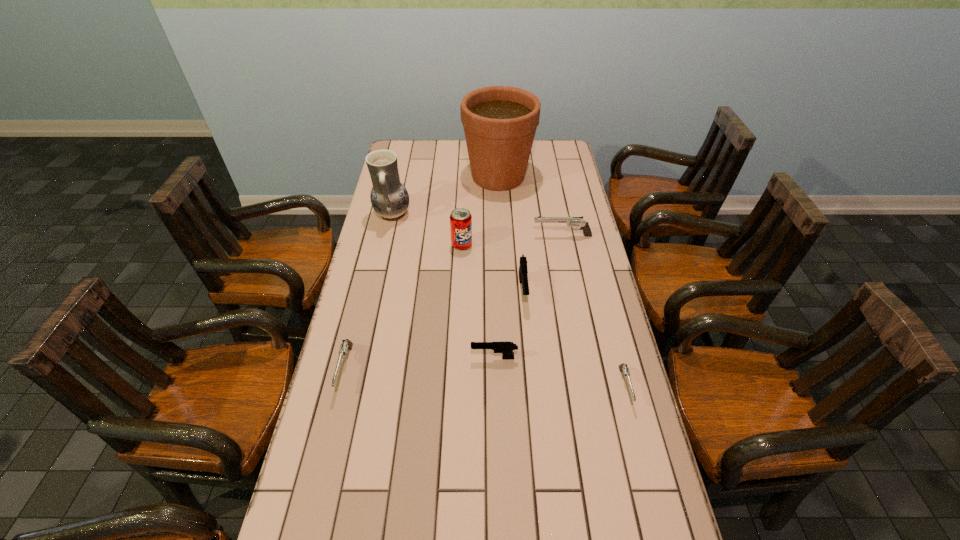
The image size is (960, 540). I want to click on vacant position located 0.150m on the front-facing side of the biggest silver pistol, so click(x=493, y=236).

At what (x,y) coordinates should I click in order to perform the action: click on vacant position located 0.340m on the front-facing side of the biggest silver pistol. Please return your answer as a coordinate pair (x, y). This screenshot has width=960, height=540. Looking at the image, I should click on (443, 236).

This screenshot has height=540, width=960. What are the coordinates of `vacant space situated 0.120m on the front-facing side of the biggest silver pistol` in the screenshot? It's located at (501, 236).

I want to click on free location located 0.230m on the front-facing side of the fourth pistol from right to left, so click(x=393, y=357).

This screenshot has width=960, height=540. I want to click on vacant region located 0.090m on the front-facing side of the fourth pistol from right to left, so click(x=441, y=357).

This screenshot has height=540, width=960. What are the coordinates of `free region located on the front-facing side of the fourth pistol from right to left` in the screenshot? It's located at (447, 357).

At what (x,y) coordinates should I click in order to perform the action: click on vacant space located 0.200m on the front-facing side of the leftmost pistol. Please return your answer as a coordinate pair (x, y). Looking at the image, I should click on [x=320, y=473].

Where is `free point located 0.220m on the front-facing side of the smallest silver pistol`? This screenshot has width=960, height=540. free point located 0.220m on the front-facing side of the smallest silver pistol is located at coordinates (653, 497).

This screenshot has height=540, width=960. What are the coordinates of `object located in the far edge section of the desktop` in the screenshot? It's located at (500, 122).

I want to click on pottery positioned at the left edge, so click(390, 199).